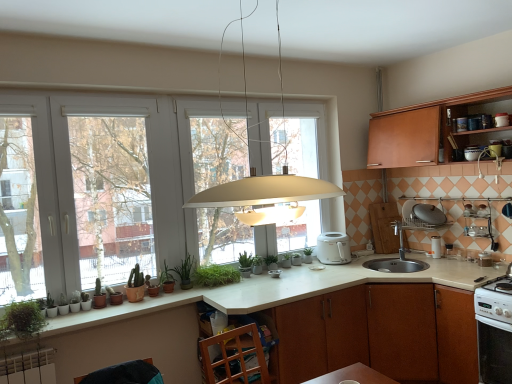
Find the location of a particular element. The height and width of the screenshot is (384, 512). vacant point to the right of green matte cactus at lower left, the third plant positioned from the front is located at coordinates (121, 300).